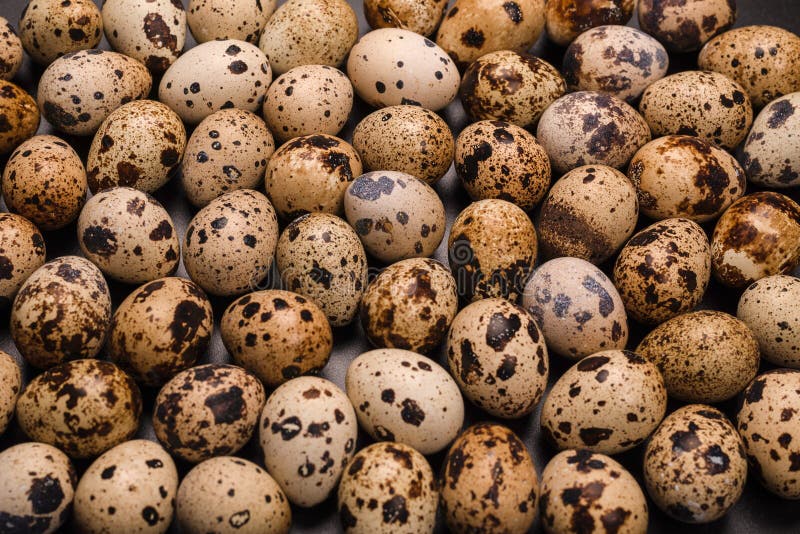
The height and width of the screenshot is (534, 800). Find the location of `table surface`. table surface is located at coordinates (345, 343), (754, 513), (450, 183), (182, 213), (452, 111), (785, 12), (358, 4), (314, 521).